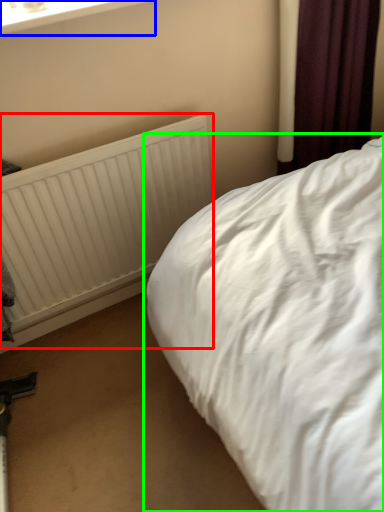
Question: Estimate the real-world distances between objects in this image. Which object is farther from radiator (highlighted by a red box), window frame (highlighted by a blue box) or bed (highlighted by a green box)?

Choices:
 (A) window frame
 (B) bed

Answer: (A)